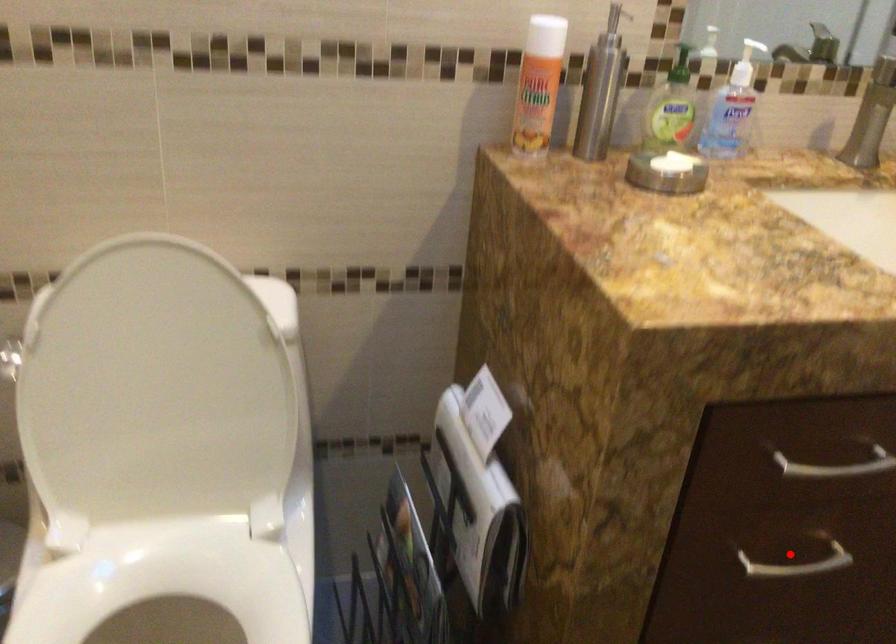
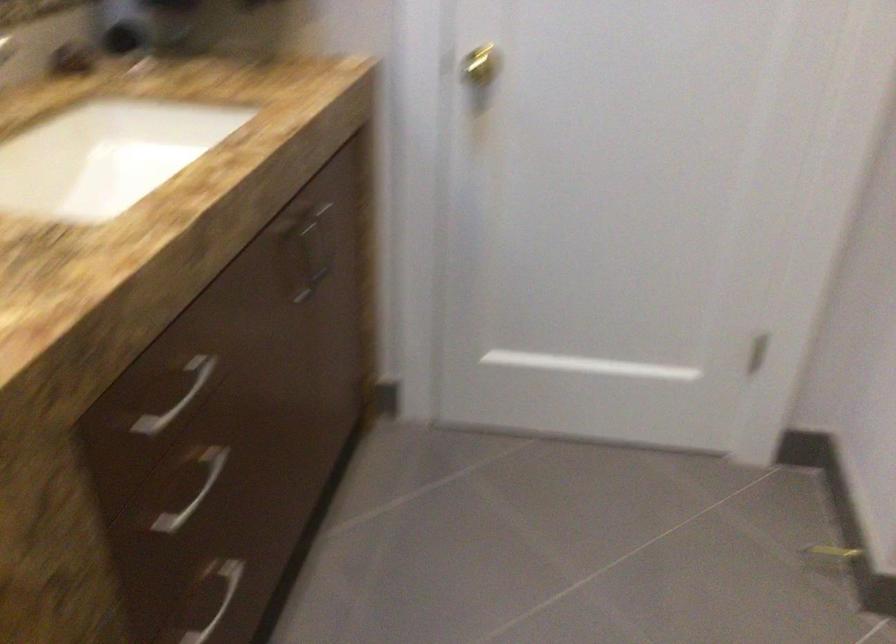
Locate, in the second image, the point that corresponds to the highlighted location in the first image.

(187, 488)